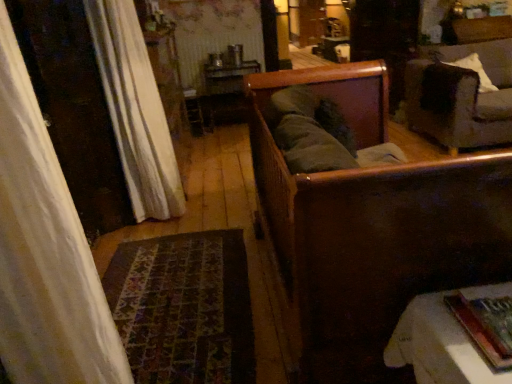
Question: Does wooden sofa at center, the 1th furniture positioned from the front, appear on the right side of dark gray fabric couch at upper right?

Choices:
 (A) yes
 (B) no

Answer: (B)

Question: From a real-world perspective, is wooden sofa at center, positioned as the second furniture in back-to-front order, on dark gray fabric couch at upper right?

Choices:
 (A) yes
 (B) no

Answer: (A)

Question: Is wooden sofa at center, positioned as the second furniture in back-to-front order, behind dark gray fabric couch at upper right?

Choices:
 (A) no
 (B) yes

Answer: (A)

Question: From a real-world perspective, is wooden sofa at center, the 1th furniture positioned from the front, positioned under dark gray fabric couch at upper right based on gravity?

Choices:
 (A) no
 (B) yes

Answer: (A)

Question: Is wooden sofa at center, the 1th furniture positioned from the front, surrounding dark gray fabric couch at upper right?

Choices:
 (A) no
 (B) yes

Answer: (A)

Question: Is point (471, 102) closer or farther from the camera than point (470, 337)?

Choices:
 (A) closer
 (B) farther

Answer: (B)

Question: Based on their sizes in the image, would you say dark gray fabric couch at upper right is bigger or smaller than hardcover book at lower right?

Choices:
 (A) big
 (B) small

Answer: (A)

Question: Considering the relative positions of dark gray fabric couch at upper right and hardcover book at lower right in the image provided, is dark gray fabric couch at upper right to the left or to the right of hardcover book at lower right?

Choices:
 (A) right
 (B) left

Answer: (A)

Question: Do you think dark gray fabric couch at upper right is within hardcover book at lower right, or outside of it?

Choices:
 (A) inside
 (B) outside

Answer: (B)

Question: In terms of height, does hardcover book at lower right look taller or shorter compared to white textured curtain at left?

Choices:
 (A) tall
 (B) short

Answer: (B)

Question: Is hardcover book at lower right bigger or smaller than white textured curtain at left?

Choices:
 (A) small
 (B) big

Answer: (A)

Question: In terms of width, does hardcover book at lower right look wider or thinner when compared to white textured curtain at left?

Choices:
 (A) wide
 (B) thin

Answer: (A)

Question: From the image's perspective, is hardcover book at lower right above or below white textured curtain at left?

Choices:
 (A) above
 (B) below

Answer: (B)

Question: Looking at their shapes, would you say white textured curtain at left is wider or thinner than white fabric tablecloth at lower right, which is the 1th furniture from back to front?

Choices:
 (A) wide
 (B) thin

Answer: (B)

Question: From a real-world perspective, is white textured curtain at left physically located above or below white fabric tablecloth at lower right, which is the 1th furniture from back to front?

Choices:
 (A) above
 (B) below

Answer: (A)